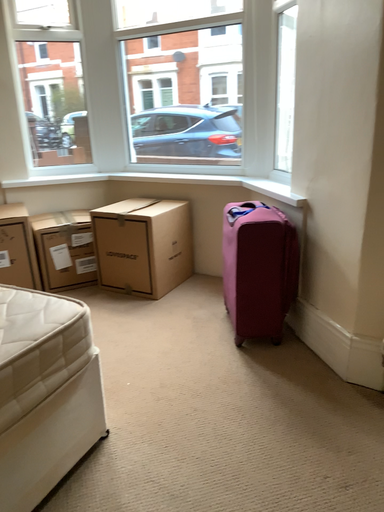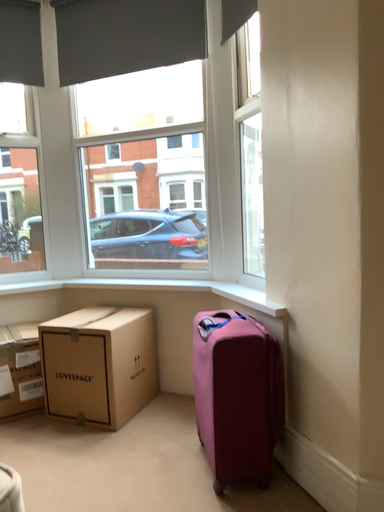
Question: Which way did the camera rotate in the video?

Choices:
 (A) rotated upward
 (B) rotated downward

Answer: (A)